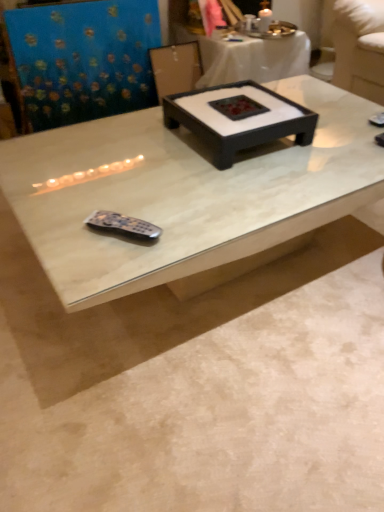
In order to click on free space in front of black matte tray at center, the first coffee table viewed from the right in this screenshot , I will do `click(232, 189)`.